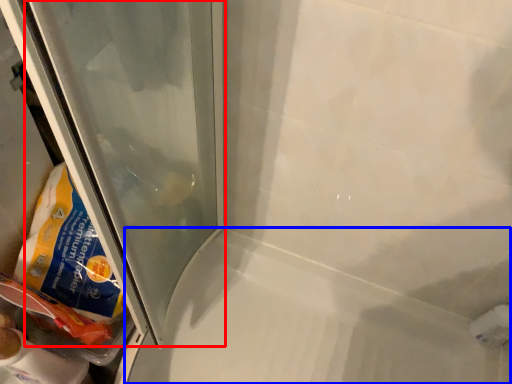
Question: Which point is closer to the camera, glass door (highlighted by a red box) or bath (highlighted by a blue box)?

Choices:
 (A) glass door
 (B) bath

Answer: (A)